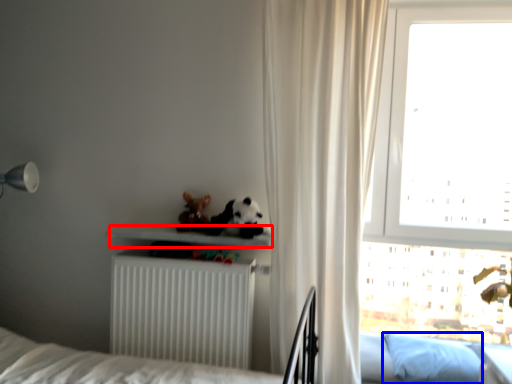
Question: Which point is closer to the camera, shelf (highlighted by a red box) or pillow (highlighted by a blue box)?

Choices:
 (A) shelf
 (B) pillow

Answer: (B)